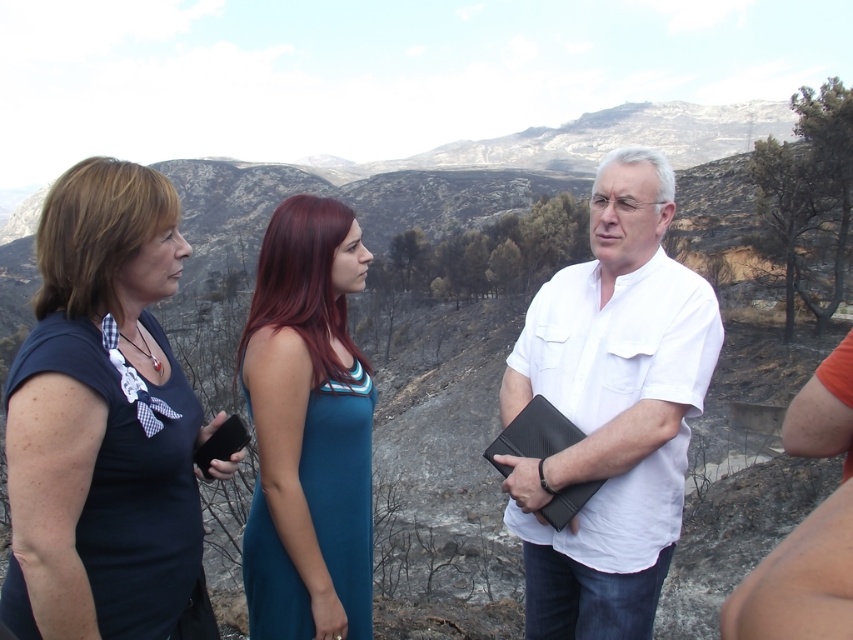
You are a photographer trying to capture a clear shot of the white matte shirt at center and the teal satin dress at center. Since both are at the center, which one is closer to you?

The white matte shirt at center is in front of the teal satin dress at center, so it is closer to you.

You are a photographer trying to capture the matte black shirt at center and the teal satin dress at center in the same frame. Which clothing item is covering part of the other?

The matte black shirt at center is positioned over the teal satin dress at center, so it is covering part of the dress.

You are a photographer standing at the edge of the scene. You want to take a photo that includes both the white matte shirt at center and the teal satin dress at center. Given that your camera has a maximum focus range of 10 meters, will you be able to capture both subjects in focus without moving?

The white matte shirt at center is 11.55 meters away from the teal satin dress at center. Since your camera can only focus up to 10 meters, the distance between them exceeds the maximum focus range. Therefore, you won cannot capture both subjects in focus without moving closer or adjusting your position.